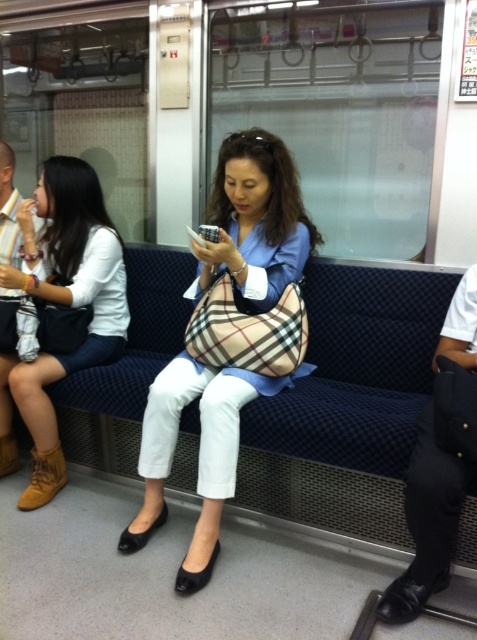
Question: Can you confirm if plaid fabric handbag at center is positioned above matte white blouse at upper left?

Choices:
 (A) no
 (B) yes

Answer: (B)

Question: Which point is closer to the camera?

Choices:
 (A) pos(6,212)
 (B) pos(122,280)

Answer: (B)

Question: Can you confirm if plaid fabric handbag at center is smaller than brown leather coach at left?

Choices:
 (A) no
 (B) yes

Answer: (A)

Question: Which point is closer to the camera taking this photo?

Choices:
 (A) (48, 458)
 (B) (1, 188)

Answer: (A)

Question: Which object is positioned closest to the matte white blouse at upper left?

Choices:
 (A) brown leather coach at left
 (B) plaid fabric handbag at center

Answer: (A)

Question: Can you confirm if matte white blouse at upper left is bigger than brown leather coach at left?

Choices:
 (A) yes
 (B) no

Answer: (A)